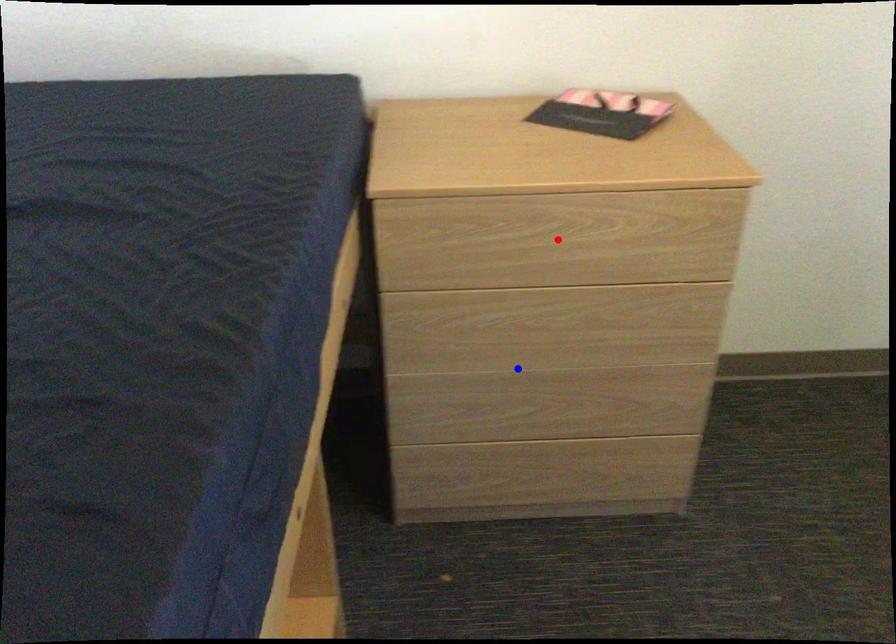
Question: In the image, two points are highlighted. Which point is nearer to the camera? Reply with the corresponding letter.

Choices:
 (A) blue point
 (B) red point

Answer: (B)